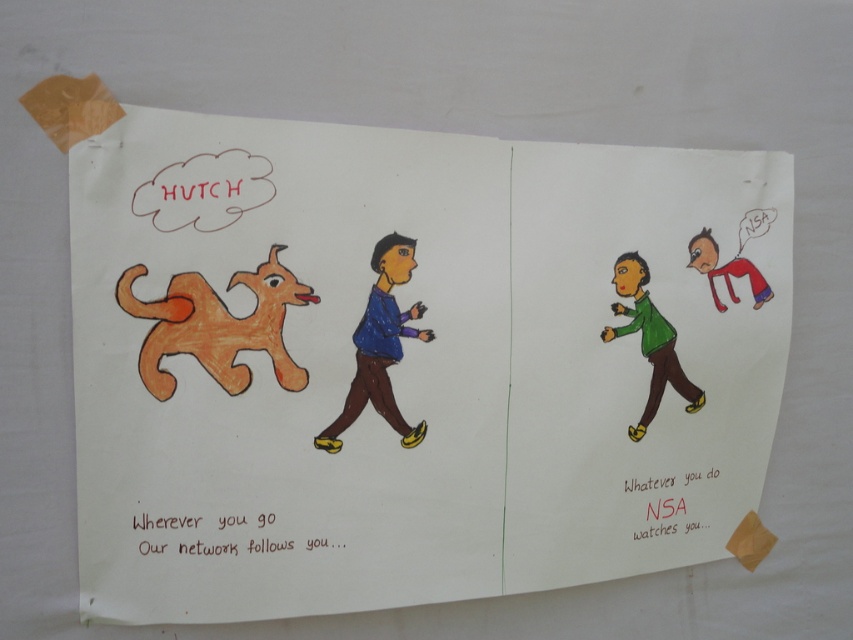
Does matte blue shirt at center have a lesser height compared to green matte shirt at center?

Incorrect, matte blue shirt at center's height does not fall short of green matte shirt at center's.

At what (x,y) coordinates should I click in order to perform the action: click on matte blue shirt at center. Please return your answer as a coordinate pair (x, y). Image resolution: width=853 pixels, height=640 pixels. Looking at the image, I should click on (380, 346).

Measure the distance between orange paper dog at left and camera.

A distance of 33.26 inches exists between orange paper dog at left and camera.

Which is more to the right, orange paper dog at left or matte blue shirt at center?

orange paper dog at left

Is point (349, 326) positioned before point (378, 340)?

Yes, point (349, 326) is closer to viewer.

The height and width of the screenshot is (640, 853). In order to click on orange paper dog at left in this screenshot , I will do `click(410, 362)`.

Can you confirm if orange paper dog at left is smaller than green matte shirt at center?

No.

Image resolution: width=853 pixels, height=640 pixels. Identify the location of orange paper dog at left. (410, 362).

Identify the location of orange paper dog at left. (410, 362).